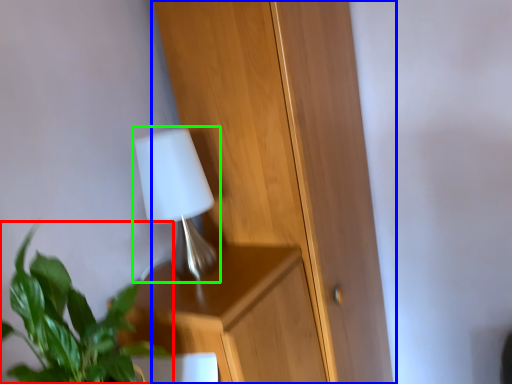
Question: Which object is the closest to the houseplant (highlighted by a red box)? Choose among these: dresser (highlighted by a blue box) or lamp (highlighted by a green box).

Choices:
 (A) dresser
 (B) lamp

Answer: (B)